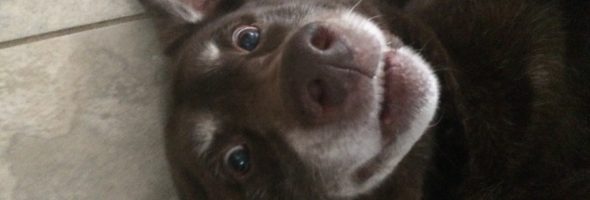
Where is `grout line`? The image size is (590, 200). grout line is located at coordinates (103, 181).